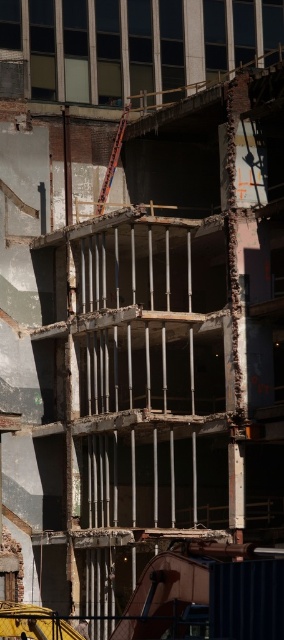
You are a construction worker standing in the partially demolished building. You see the metallic helmet at center and the yellow hard hat at center. Which one is positioned to the right side?

The metallic helmet at center is positioned to the right of the yellow hard hat at center.

You are a construction worker standing in the partially demolished building. You see the rusty metal scaffolding at center and the metallic helmet at center. Which object is positioned to the right side from your perspective?

The rusty metal scaffolding at center is to the right of the metallic helmet at center, so the rusty metal scaffolding at center is positioned to the right side from your perspective.